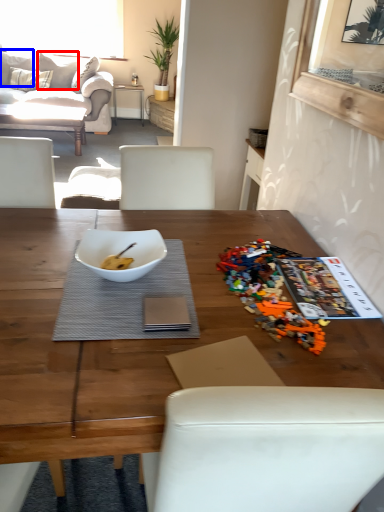
Question: Which object appears closest to the camera in this image, pillow (highlighted by a red box) or pillow (highlighted by a blue box)?

Choices:
 (A) pillow
 (B) pillow

Answer: (B)